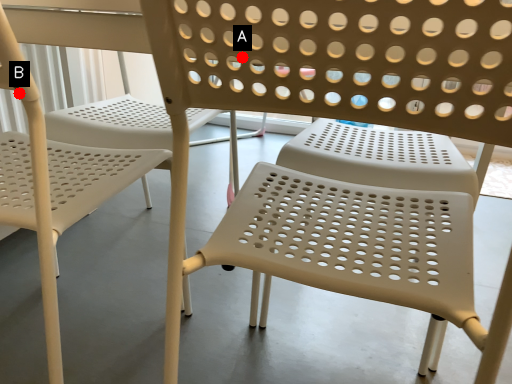
Question: Two points are circled on the image, labeled by A and B beside each circle. Which point is farther from the camera taking this photo?

Choices:
 (A) A is further
 (B) B is further

Answer: (B)